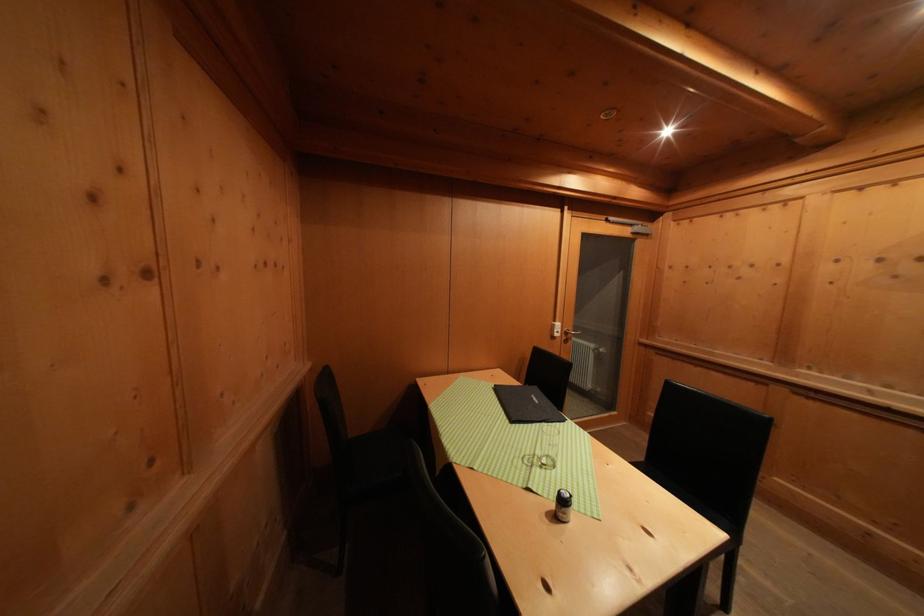
Which object does [526,405] point to?

This point indicates the black menu folder.